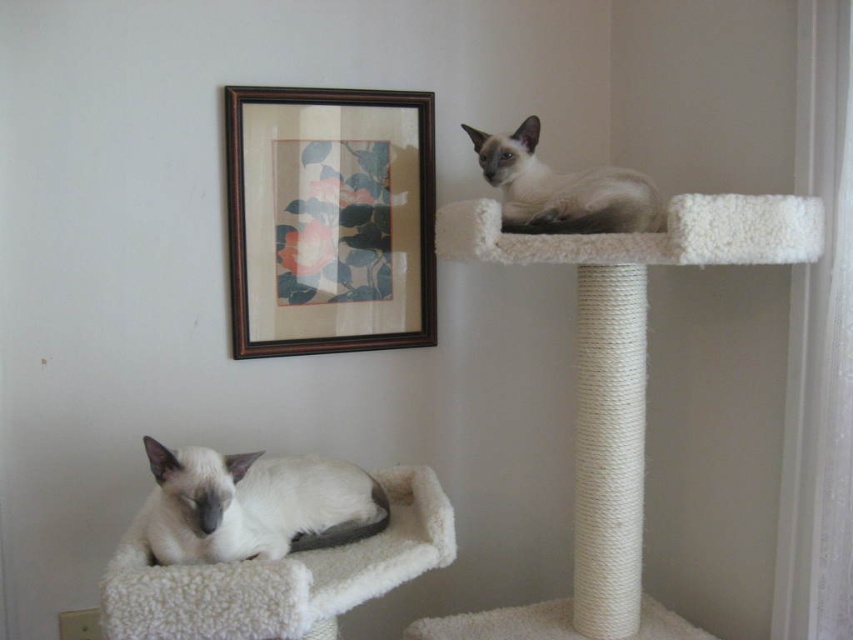
Question: Does brown wooden picture frame at upper center appear under white fluffy cat bed at lower left?

Choices:
 (A) yes
 (B) no

Answer: (B)

Question: Which of these objects is positioned closest to the white soft cat at lower left?

Choices:
 (A) satin fur cat at upper right
 (B) brown wooden picture frame at upper center

Answer: (B)

Question: Which point is farther to the camera?

Choices:
 (A) (438, 516)
 (B) (532, 228)

Answer: (A)

Question: Which point is farther from the camera taking this photo?

Choices:
 (A) (526, 211)
 (B) (389, 483)
 (C) (300, 237)

Answer: (C)

Question: Does white soft cat at lower left appear over satin fur cat at upper right?

Choices:
 (A) no
 (B) yes

Answer: (A)

Question: Is brown wooden picture frame at upper center bigger than white soft cat at lower left?

Choices:
 (A) no
 (B) yes

Answer: (B)